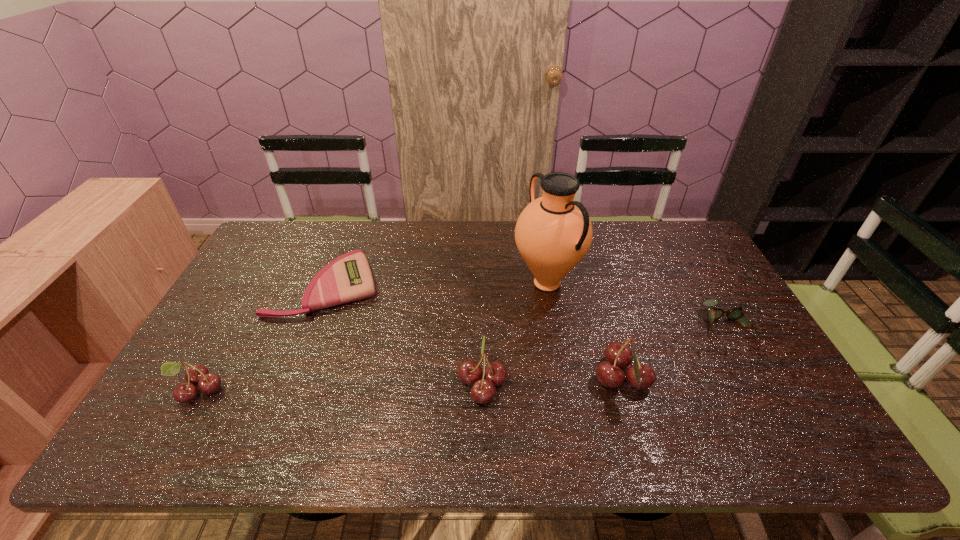
At what (x,y) coordinates should I click in order to perform the action: click on object that stands as the closest to the shortest object. Please return your answer as a coordinate pair (x, y). The width and height of the screenshot is (960, 540). Looking at the image, I should click on (197, 374).

Identify which cherry is located as the second nearest to the second shortest cherry. Please provide its 2D coordinates. Your answer should be formatted as a tuple, i.e. [(x, y)], where the tuple contains the x and y coordinates of a point satisfying the conditions above.

[(197, 374)]

Where is `cherry that stands as the closest to the second shortest cherry`? The image size is (960, 540). cherry that stands as the closest to the second shortest cherry is located at coordinates (609, 373).

This screenshot has width=960, height=540. What are the coordinates of `vacant space that satisfies the following two spatial constraints: 1. on the front-facing side of the rightmost object; 2. on the leaves of the third tallest object` in the screenshot? It's located at (758, 383).

The height and width of the screenshot is (540, 960). Identify the location of free point that satisfies the following two spatial constraints: 1. on the front-facing side of the spectacles; 2. on the leaves of the rightmost cherry. (756, 380).

You are a GUI agent. You are given a task and a screenshot of the screen. Output one action in this format:
    pyautogui.click(x=<x>, y=<y>)
    Task: Click on the free space that satisfies the following two spatial constraints: 1. on the leaves of the rightmost cherry; 2. on the leaves of the third shortest object
    The height and width of the screenshot is (540, 960).
    Given the screenshot: What is the action you would take?
    pyautogui.click(x=625, y=389)

Image resolution: width=960 pixels, height=540 pixels. Identify the location of free spot that satisfies the following two spatial constraints: 1. on the leaves of the rightmost cherry; 2. on the leaves of the third shortest object. (625, 389).

This screenshot has width=960, height=540. I want to click on vacant space that satisfies the following two spatial constraints: 1. on the leaves of the rightmost cherry; 2. on the leaves of the third shortest object, so click(625, 389).

Identify the location of free space that satisfies the following two spatial constraints: 1. on the front side of the tallest object; 2. on the leaves of the third tallest object. (564, 383).

Identify the location of vacant region that satisfies the following two spatial constraints: 1. on the front-facing side of the second shortest object; 2. on the leaves of the rightmost cherry. This screenshot has width=960, height=540. (756, 380).